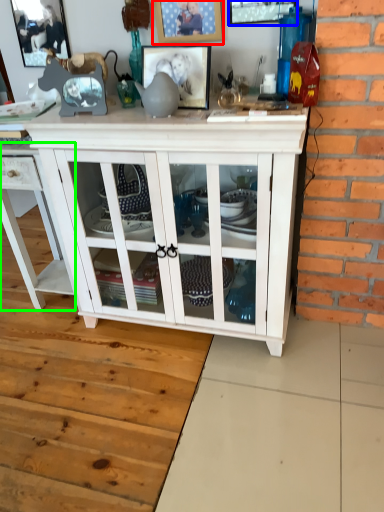
Question: Considering the real-world distances, which object is closest to picture frame (highlighted by a red box)? picture frame (highlighted by a blue box) or cabinetry (highlighted by a green box).

Choices:
 (A) picture frame
 (B) cabinetry

Answer: (A)